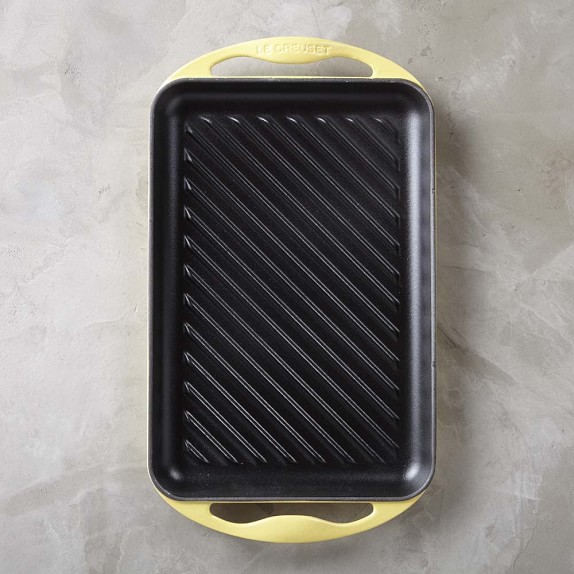
At what (x,y) coordinates should I click in order to perform the action: click on tray. Please return your answer as a coordinate pair (x, y). Image resolution: width=574 pixels, height=574 pixels. Looking at the image, I should click on (364, 433).